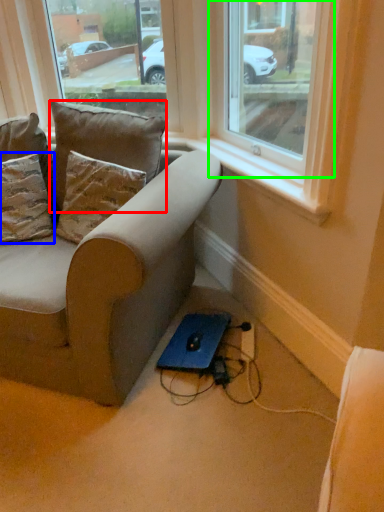
Question: Which is nearer to the pillow (highlighted by a red box)? pillow (highlighted by a blue box) or window (highlighted by a green box).

Choices:
 (A) pillow
 (B) window

Answer: (A)